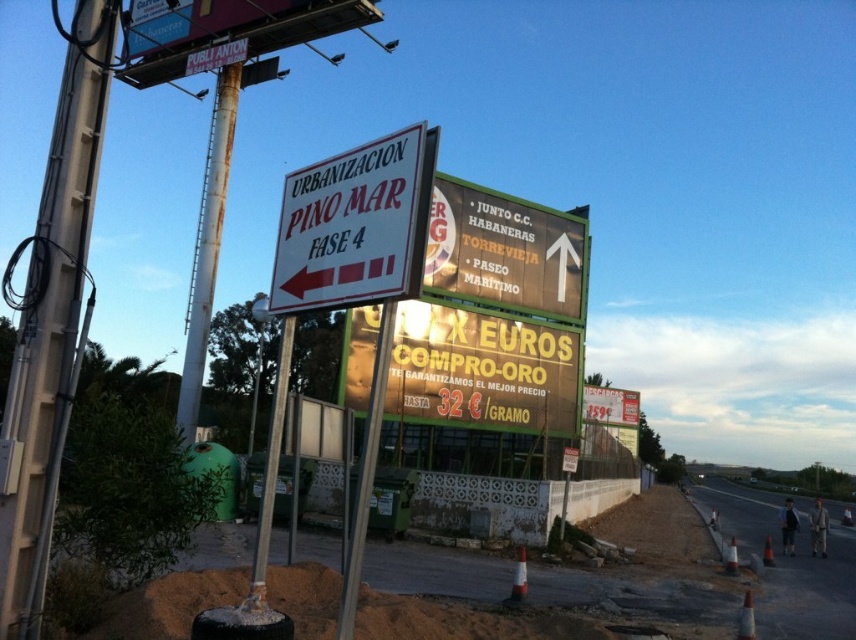
Which is behind, point (302, 170) or point (204, 352)?

Positioned behind is point (204, 352).

The image size is (856, 640). In order to click on white matte sign at left in this screenshot , I will do `click(355, 225)`.

Is white matte sign at left wider than green matte sign at upper center?

No, white matte sign at left is not wider than green matte sign at upper center.

Between white matte sign at left and green matte sign at upper center, which one is positioned higher?

white matte sign at left is higher up.

What do you see at coordinates (355, 225) in the screenshot? Image resolution: width=856 pixels, height=640 pixels. I see `white matte sign at left` at bounding box center [355, 225].

Where is `white matte sign at left`? Image resolution: width=856 pixels, height=640 pixels. white matte sign at left is located at coordinates (355, 225).

Between green matte sign at upper center and metallic pole at center, which one is positioned lower?

Positioned lower is metallic pole at center.

Which is in front, point (528, 211) or point (257, 563)?

Point (257, 563) is in front.

The width and height of the screenshot is (856, 640). Find the location of `green matte sign at upper center`. green matte sign at upper center is located at coordinates (504, 252).